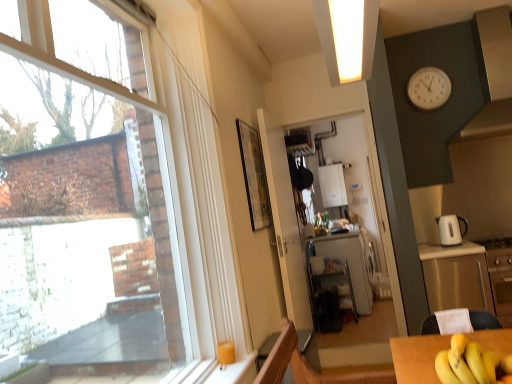
What do you see at coordinates (361, 262) in the screenshot?
I see `white glossy refrigerator at center` at bounding box center [361, 262].

What do you see at coordinates (349, 263) in the screenshot?
I see `white glossy refrigerator at center` at bounding box center [349, 263].

What do you see at coordinates (226, 352) in the screenshot? I see `matte yellow cup at lower left` at bounding box center [226, 352].

You are a GUI agent. You are given a task and a screenshot of the screen. Output one action in this format:
    pyautogui.click(x=<x>, y=<y>)
    Task: Click on the matte yellow cup at lower left
    
    Given the screenshot: What is the action you would take?
    pyautogui.click(x=226, y=352)

Measure the distance between stainless steel cabinet at right and camera.

2.73 meters.

Image resolution: width=512 pixels, height=384 pixels. Identify the location of yellow matte bananas at lower right. (468, 363).

Considering the points (326, 196) and (259, 185), which point is behind, point (326, 196) or point (259, 185)?

Positioned behind is point (326, 196).

From the image's perspective, which is above, white glossy boiler at center or wooden framed artwork at center?

From the image's view, white glossy boiler at center is above.

Can you confirm if white glossy boiler at center is positioned to the left of wooden framed artwork at center?

Incorrect, white glossy boiler at center is not on the left side of wooden framed artwork at center.

From the image's perspective, is yellow matte bananas at lower right located above or below stainless steel cabinet at right?

From the image's perspective, yellow matte bananas at lower right appears above stainless steel cabinet at right.

Which is more to the right, yellow matte bananas at lower right or stainless steel cabinet at right?

Positioned to the right is stainless steel cabinet at right.

Which of these two, yellow matte bananas at lower right or stainless steel cabinet at right, is smaller?

With smaller size is yellow matte bananas at lower right.

Is point (475, 343) closer to viewer compared to point (489, 297)?

Yes, point (475, 343) is in front of point (489, 297).

Is white glossy electric kettle at right facing away from white glossy exhaust hood at upper right?

That's not correct — white glossy electric kettle at right is not looking away from white glossy exhaust hood at upper right.

Between white glossy electric kettle at right and white glossy exhaust hood at upper right, which one has less height?

white glossy electric kettle at right is shorter.

Is white glossy exhaust hood at upper right surrounded by white glossy electric kettle at right?

Definitely not — white glossy exhaust hood at upper right is not inside white glossy electric kettle at right.

Considering the relative positions of white glossy boiler at center and white glossy exhaust hood at upper right in the image provided, is white glossy boiler at center to the left or to the right of white glossy exhaust hood at upper right?

white glossy boiler at center is to the left of white glossy exhaust hood at upper right.

Considering the relative sizes of white glossy boiler at center and white glossy exhaust hood at upper right in the image provided, is white glossy boiler at center wider than white glossy exhaust hood at upper right?

No.

Is white glossy boiler at center positioned with its back to white glossy exhaust hood at upper right?

white glossy boiler at center does not have its back to white glossy exhaust hood at upper right.

Is white glossy refrigerator at center looking in the opposite direction of white glossy door at center?

white glossy refrigerator at center is not turned away from white glossy door at center.

Would you consider white glossy refrigerator at center to be distant from white glossy door at center?

Indeed, white glossy refrigerator at center is not near white glossy door at center.

Which is nearer, [359,234] or [273,203]?

The point [273,203] is closer to the camera.

From the image's perspective, is white glossy refrigerator at center beneath white glossy door at center?

Yes.

From the image's perspective, does matte yellow cup at lower left appear lower than white glossy refrigerator at center?

Incorrect, from the image's perspective, matte yellow cup at lower left is higher than white glossy refrigerator at center.

Does matte yellow cup at lower left have a greater width compared to white glossy refrigerator at center?

In fact, matte yellow cup at lower left might be narrower than white glossy refrigerator at center.

Image resolution: width=512 pixels, height=384 pixels. I want to click on coffee cup above the white glossy refrigerator at center (from the image's perspective), so click(x=226, y=352).

Who is taller, white plastic clock at upper right or white glossy exhaust hood at upper right?

white glossy exhaust hood at upper right.

Is white glossy exhaust hood at upper right at the back of white plastic clock at upper right?

No, white plastic clock at upper right's orientation is not away from white glossy exhaust hood at upper right.

Consider the image. Can you confirm if white plastic clock at upper right is smaller than white glossy exhaust hood at upper right?

Correct, white plastic clock at upper right occupies less space than white glossy exhaust hood at upper right.

Can you confirm if white plastic clock at upper right is positioned to the left of white glossy exhaust hood at upper right?

Yes.

Image resolution: width=512 pixels, height=384 pixels. In order to click on picture frame on the left of white glossy boiler at center in this screenshot , I will do `click(254, 176)`.

The image size is (512, 384). I want to click on cabinetry located on the right of yellow matte bananas at lower right, so click(456, 277).

From the image, which object appears to be farther from stainless steel cabinet at right, white glossy door at center or white glossy electric kettle at right?

white glossy door at center is further to stainless steel cabinet at right.

When comparing their distances from yellow matte bananas at lower right, does stainless steel cabinet at right or transparent glass window at upper left seem further?

transparent glass window at upper left lies further to yellow matte bananas at lower right than the other object.

From the image, which object appears to be nearer to white plastic clock at upper right, white glossy boiler at center or yellow matte bananas at lower right?

white glossy boiler at center.

Considering their positions, is yellow matte bananas at lower right positioned closer to white glossy exhaust hood at upper right than matte yellow cup at lower left?

The object closer to white glossy exhaust hood at upper right is yellow matte bananas at lower right.

In the scene shown: Estimate the real-world distances between objects in this image. Which object is closer to stainless steel cabinet at right, yellow matte bananas at lower right or white glossy door at center?

white glossy door at center.

Looking at this image, which object lies further to the anchor point stainless steel cabinet at right, white glossy exhaust hood at upper right or transparent glass window at upper left?

The object further to stainless steel cabinet at right is transparent glass window at upper left.

From the image, which object appears to be farther from matte yellow cup at lower left, transparent glass window at upper left or white glossy boiler at center?

white glossy boiler at center is further to matte yellow cup at lower left.

From the image, which object appears to be farther from white glossy refrigerator at center, transparent glass window at upper left or white glossy boiler at center?

transparent glass window at upper left.

Locate an element on the screen. door between white glossy exhaust hood at upper right and stainless steel cabinet at right in the up-down direction is located at coordinates (285, 221).

Locate an element on the screen. This screenshot has width=512, height=384. coffee cup between transparent glass window at upper left and white glossy refrigerator at center from front to back is located at coordinates (226, 352).

Find the location of a particular element. Image resolution: width=512 pixels, height=384 pixels. cabinetry positioned between transparent glass window at upper left and white glossy electric kettle at right from near to far is located at coordinates (456, 277).

Where is `clock between white glossy exhaust hood at upper right and white glossy electric kettle at right vertically`? The height and width of the screenshot is (384, 512). clock between white glossy exhaust hood at upper right and white glossy electric kettle at right vertically is located at coordinates (429, 88).